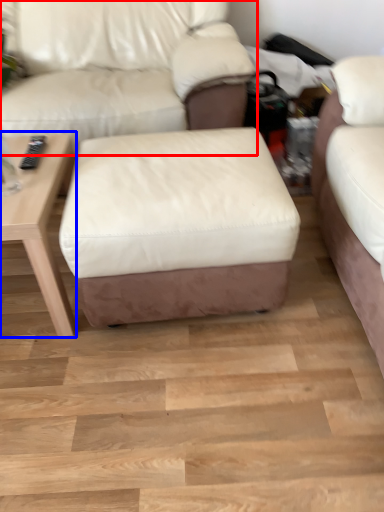
Question: Which point is closer to the camera, studio couch (highlighted by a red box) or table (highlighted by a blue box)?

Choices:
 (A) studio couch
 (B) table

Answer: (B)